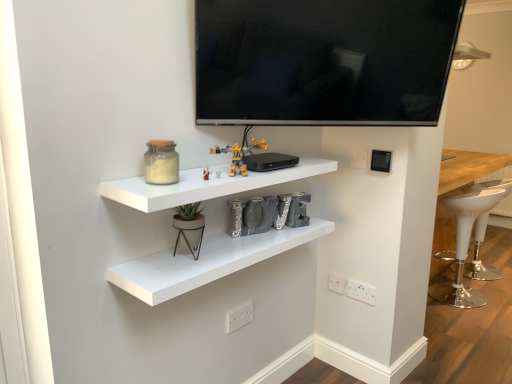
Identify the location of free location in front of translucent glass jar at upper left. This screenshot has height=384, width=512. (152, 181).